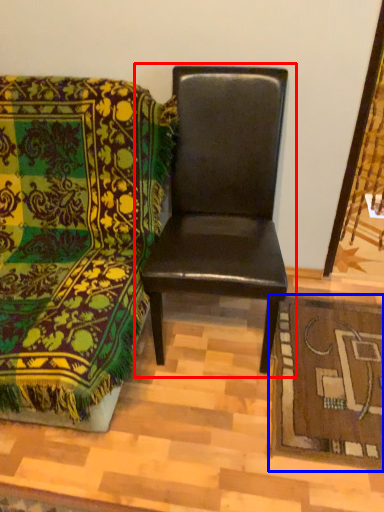
Question: Which of the following is the closest to the observer, chair (highlighted by a red box) or mat (highlighted by a blue box)?

Choices:
 (A) chair
 (B) mat

Answer: (A)